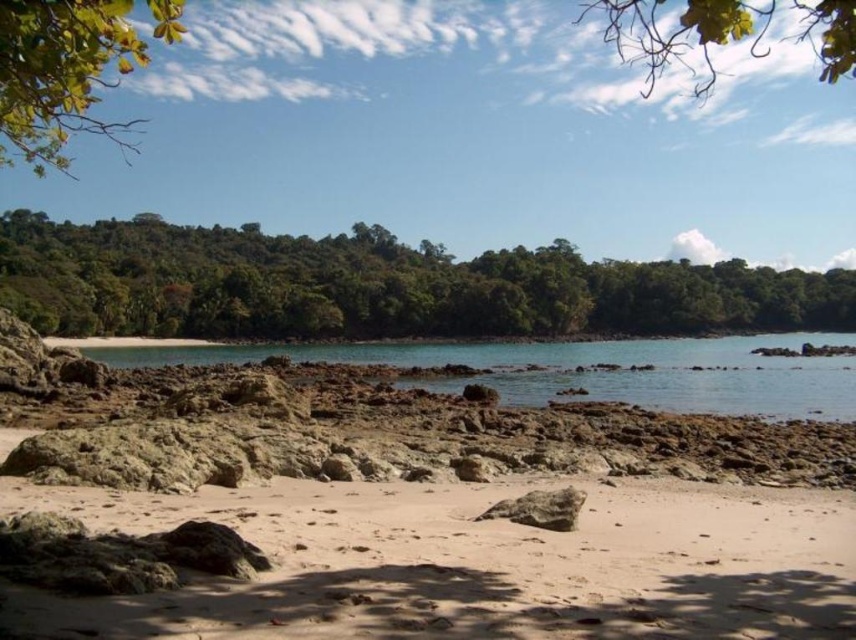
Image resolution: width=856 pixels, height=640 pixels. In order to click on sandy beach at center in this screenshot , I will do `click(477, 564)`.

Is point (602, 627) positioned in front of point (587, 355)?

Yes, it is in front of point (587, 355).

Where is `sandy beach at center`? Image resolution: width=856 pixels, height=640 pixels. sandy beach at center is located at coordinates (477, 564).

From the picture: Between sandy beach at center and green leafy tree at upper center, which one appears on the left side from the viewer's perspective?

sandy beach at center

Between point (590, 554) and point (679, 24), which one is positioned in front?

Positioned in front is point (590, 554).

Which is in front, point (218, 602) or point (607, 22)?

Point (218, 602) is more forward.

Image resolution: width=856 pixels, height=640 pixels. I want to click on sandy beach at center, so click(477, 564).

Can you confirm if green leafy tree at upper left is smaller than green leafy tree at upper center?

Yes, green leafy tree at upper left is smaller than green leafy tree at upper center.

Is green leafy tree at upper left bigger than green leafy tree at upper center?

No, green leafy tree at upper left is not bigger than green leafy tree at upper center.

The width and height of the screenshot is (856, 640). What do you see at coordinates (67, 68) in the screenshot?
I see `green leafy tree at upper left` at bounding box center [67, 68].

Locate an element on the screen. The image size is (856, 640). green leafy tree at upper left is located at coordinates (67, 68).